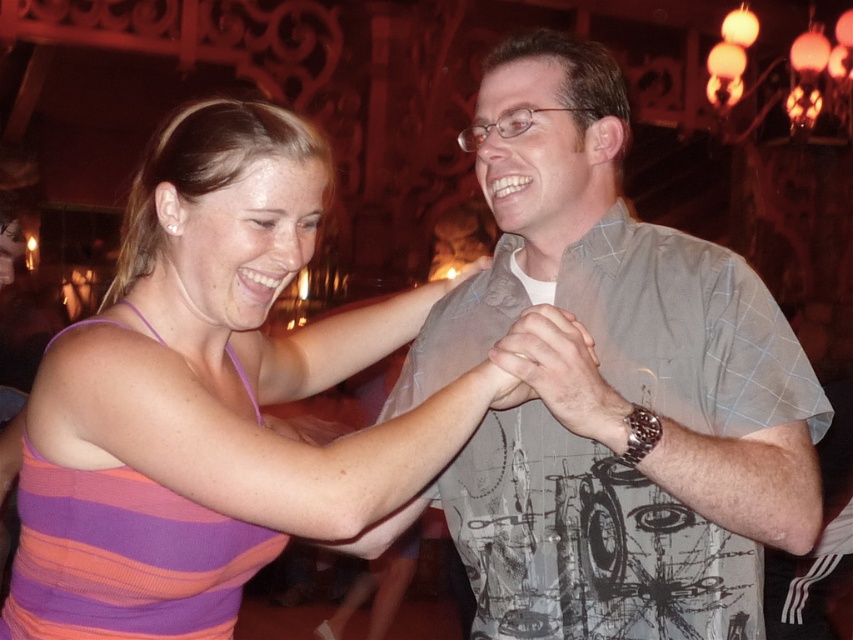
Question: Considering the real-world distances, which object is farthest from the gray checkered shirt at center?

Choices:
 (A) striped tank top at center
 (B) purple striped tank top at center

Answer: (B)

Question: Which point is closer to the camera?

Choices:
 (A) purple striped tank top at center
 (B) gray checkered shirt at center
 (C) striped tank top at center

Answer: (C)

Question: Which point appears closest to the camera in this image?

Choices:
 (A) (607, 173)
 (B) (28, 582)
 (C) (253, 304)

Answer: (B)

Question: Is gray checkered shirt at center smaller than striped tank top at center?

Choices:
 (A) no
 (B) yes

Answer: (B)

Question: Is striped tank top at center positioned behind purple striped tank top at center?

Choices:
 (A) no
 (B) yes

Answer: (A)

Question: Does gray checkered shirt at center have a greater width compared to purple striped tank top at center?

Choices:
 (A) yes
 (B) no

Answer: (A)